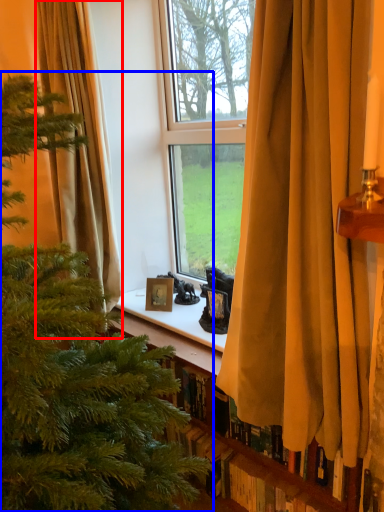
Question: Which object is closer to the camera taking this photo, curtain (highlighted by a red box) or christmas tree (highlighted by a blue box)?

Choices:
 (A) curtain
 (B) christmas tree

Answer: (B)